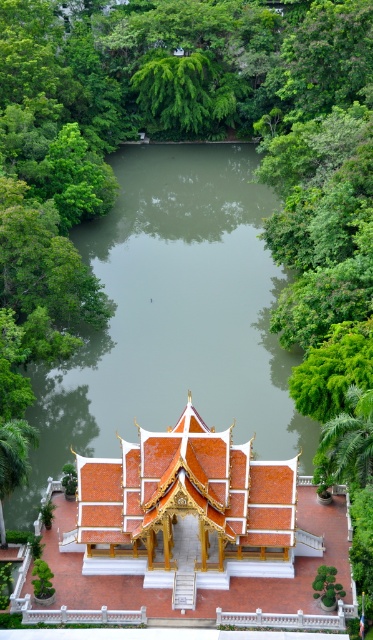
Who is taller, green water at center or shiny orange roof at center?

green water at center is taller.

Is green water at center below shiny orange roof at center?

No.

This screenshot has width=373, height=640. In order to click on green water at center in this screenshot , I will do `click(173, 317)`.

Find the location of `green water at center`. green water at center is located at coordinates [x=173, y=317].